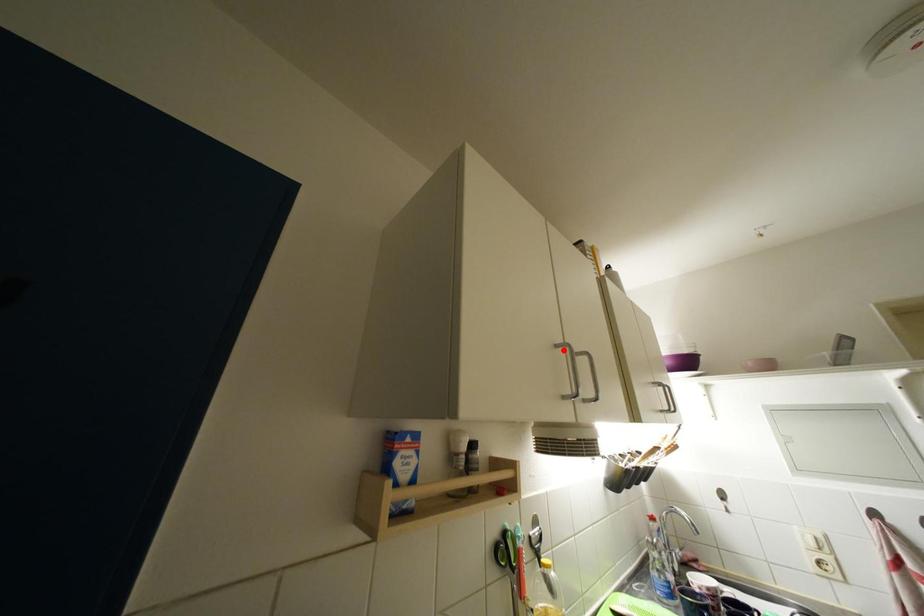
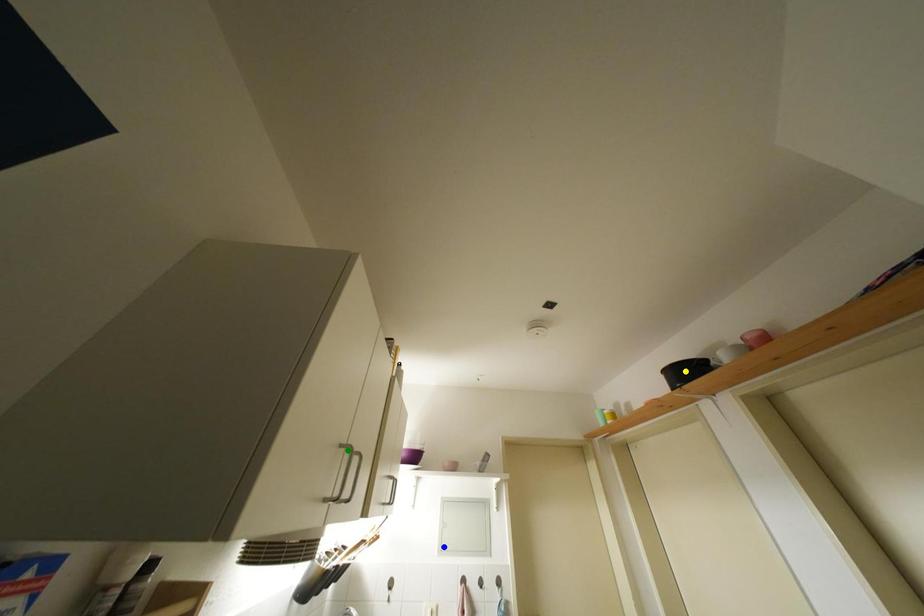
Question: I am providing you with two images of the same scene from different viewpoints. A red point is marked on the first image. You are given multiple points on the second image. In image 2, which mark is for the same physical point as the one in image 1?

Choices:
 (A) yellow point
 (B) green point
 (C) blue point

Answer: (B)